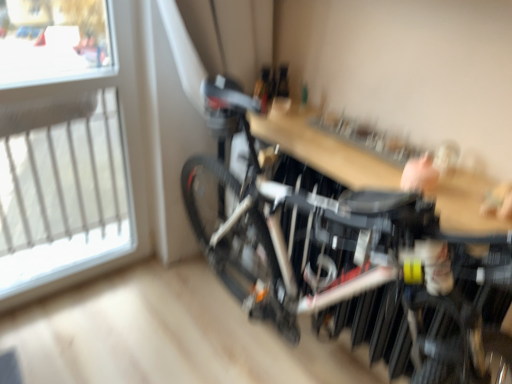
Question: From the image's perspective, is transparent glass window at upper left located above or below wooden table at center?

Choices:
 (A) above
 (B) below

Answer: (B)

Question: Based on their sizes in the image, would you say transparent glass window at upper left is bigger or smaller than wooden table at center?

Choices:
 (A) big
 (B) small

Answer: (A)

Question: Estimate the real-world distances between objects in this image. Which object is farther from the wooden table at center?

Choices:
 (A) transparent glass window at upper left
 (B) black matte bicycle at center

Answer: (A)

Question: Which is nearer to the wooden table at center?

Choices:
 (A) transparent glass window at upper left
 (B) black matte bicycle at center

Answer: (B)